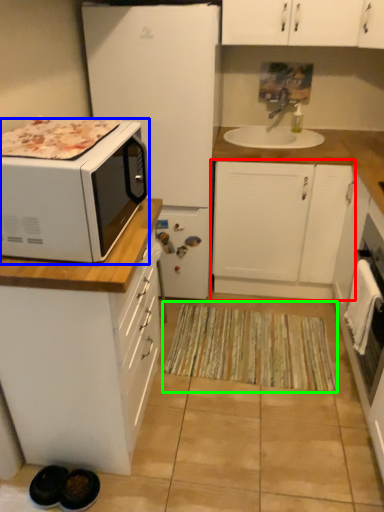
Question: Based on their relative distances, which object is nearer to cabinetry (highlighted by a red box)? Choose from microwave oven (highlighted by a blue box) and doormat (highlighted by a green box).

Choices:
 (A) microwave oven
 (B) doormat

Answer: (B)